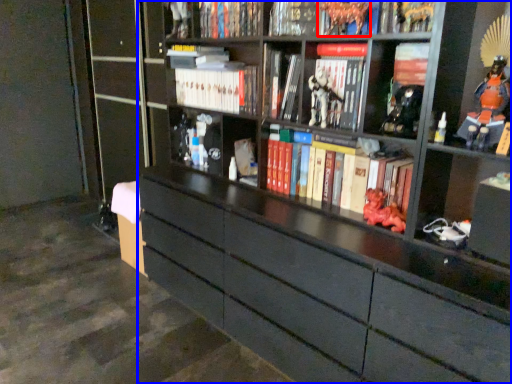
Question: Which of the following is the closest to the observer, toy (highlighted by a red box) or bookcase (highlighted by a blue box)?

Choices:
 (A) toy
 (B) bookcase

Answer: (B)